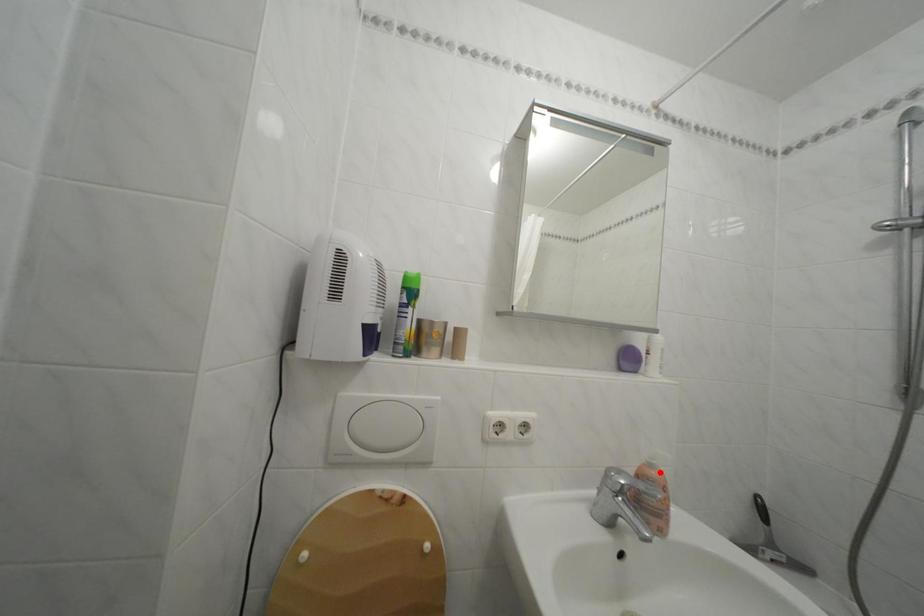
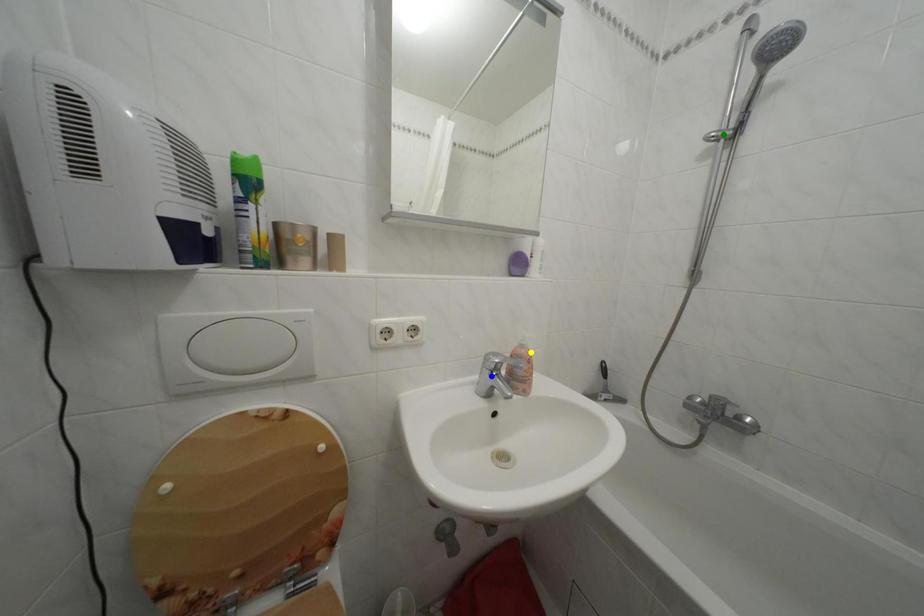
Question: I am providing you with two images of the same scene from different viewpoints. A red point is marked on the first image. You are given multiple points on the second image. Which point in image 2 is actually the same real-world point as the red point in image 1?

Choices:
 (A) blue point
 (B) yellow point
 (C) green point

Answer: (B)